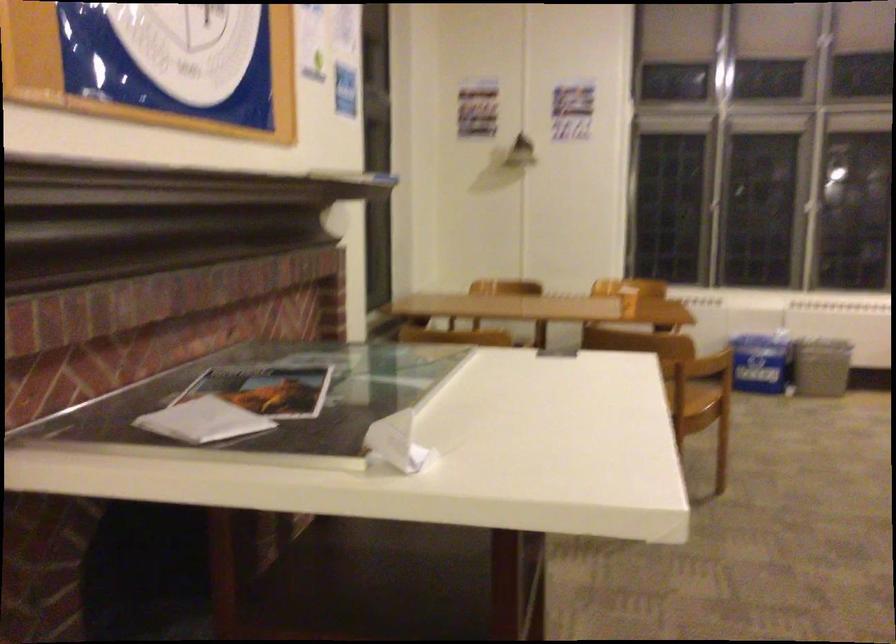
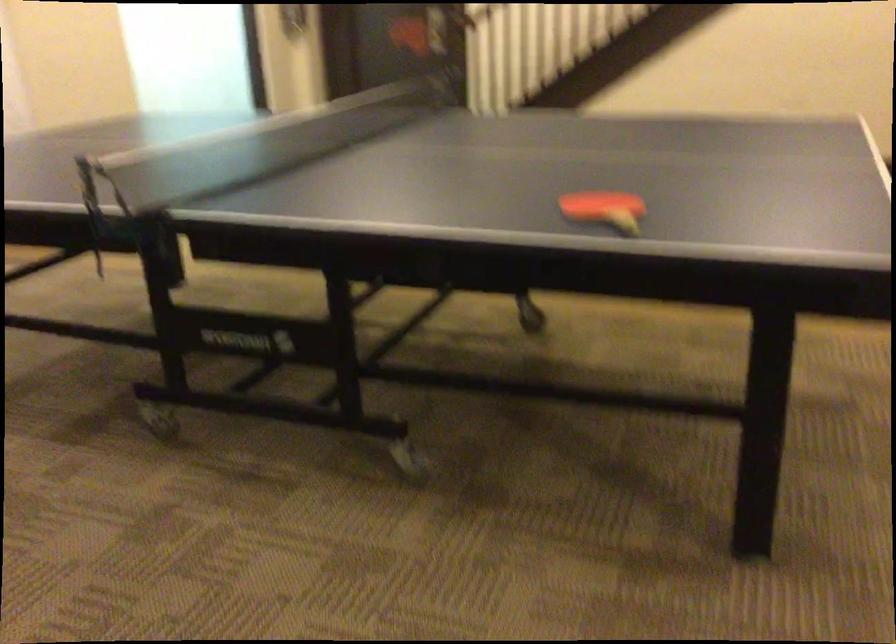
First-person continuous shooting, in which direction is the camera rotating?

The camera rotated toward right-down.